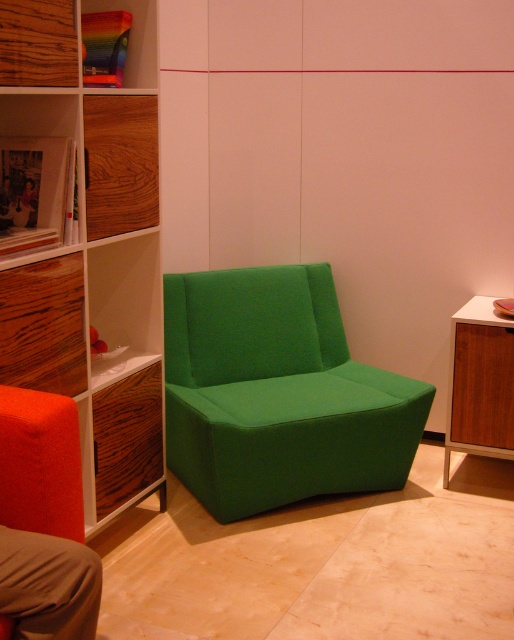
Is point (50, 346) closer to viewer compared to point (503, 403)?

That is True.

Between woodenmaterial/texturebookshelf at left and wooden cabinet at right, which one has less height?

With less height is wooden cabinet at right.

Is point (68, 196) positioned in front of point (451, 394)?

Yes, it is in front of point (451, 394).

You are a GUI agent. You are given a task and a screenshot of the screen. Output one action in this format:
    pyautogui.click(x=<x>, y=<y>)
    Task: Click on the woodenmaterial/texturebookshelf at left
    This screenshot has height=640, width=514.
    Given the screenshot: What is the action you would take?
    pyautogui.click(x=91, y=284)

Is point (79, 468) closer to camera compared to point (507, 356)?

Yes, point (79, 468) is closer to viewer.

Who is more distant from viewer, (82, 525) or (504, 442)?

Point (504, 442)

Identify the location of matte orange cushion at lower left. The width and height of the screenshot is (514, 640). (40, 464).

Can you confirm if woodenmaterial/texturebookshelf at left is positioned to the right of green fabric armchair at center?

In fact, woodenmaterial/texturebookshelf at left is to the left of green fabric armchair at center.

Which is above, woodenmaterial/texturebookshelf at left or green fabric armchair at center?

Positioned higher is woodenmaterial/texturebookshelf at left.

What do you see at coordinates (91, 284) in the screenshot? I see `woodenmaterial/texturebookshelf at left` at bounding box center [91, 284].

At what (x,y) coordinates should I click in order to perform the action: click on woodenmaterial/texturebookshelf at left. Please return your answer as a coordinate pair (x, y). The image size is (514, 640). Looking at the image, I should click on (91, 284).